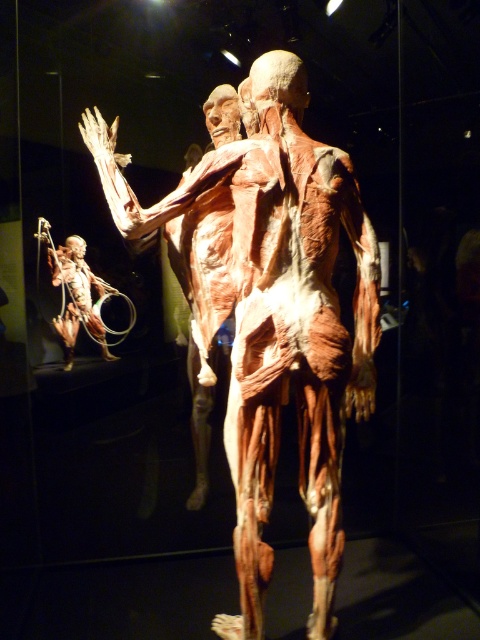
Question: Considering the relative positions of natural flesh-colored muscle at center and translucent flesh-like figure at lower left in the image provided, where is natural flesh-colored muscle at center located with respect to translucent flesh-like figure at lower left?

Choices:
 (A) right
 (B) left

Answer: (A)

Question: Does natural flesh-colored muscle at center lie behind translucent flesh-like figure at lower left?

Choices:
 (A) no
 (B) yes

Answer: (A)

Question: Is natural flesh-colored muscle at center to the left of translucent flesh-like figure at lower left from the viewer's perspective?

Choices:
 (A) yes
 (B) no

Answer: (B)

Question: Which point is farther to the camera?

Choices:
 (A) natural flesh-colored muscle at center
 (B) translucent flesh-like figure at lower left

Answer: (B)